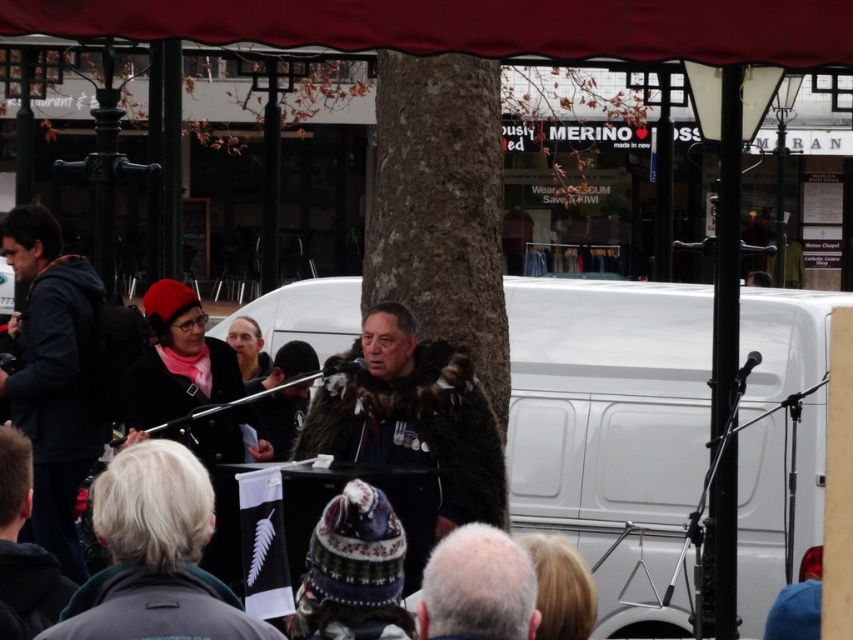
Does brown rough bark at center come behind gray woolen hat at lower center?

That is True.

Is point (437, 72) closer to viewer compared to point (442, 573)?

No, it is behind (442, 573).

Describe the element at coordinates (440, 205) in the screenshot. I see `brown rough bark at center` at that location.

Where is `brown rough bark at center`? The image size is (853, 640). brown rough bark at center is located at coordinates (440, 205).

Who is more forward, (415, 170) or (71, 444)?

Point (415, 170)

Does brown rough bark at center have a greater height compared to dark blue hoodie at left?

Yes.

Which is in front, point (480, 83) or point (90, 304)?

Point (480, 83) is in front.

This screenshot has width=853, height=640. Identify the location of brown rough bark at center. (440, 205).

Is white matte van at center shorter than brown rough bark at center?

No, white matte van at center is not shorter than brown rough bark at center.

Between white matte van at center and brown rough bark at center, which one appears on the left side from the viewer's perspective?

Positioned to the left is brown rough bark at center.

What do you see at coordinates (611, 432) in the screenshot? I see `white matte van at center` at bounding box center [611, 432].

Locate an element on the screen. white matte van at center is located at coordinates (611, 432).